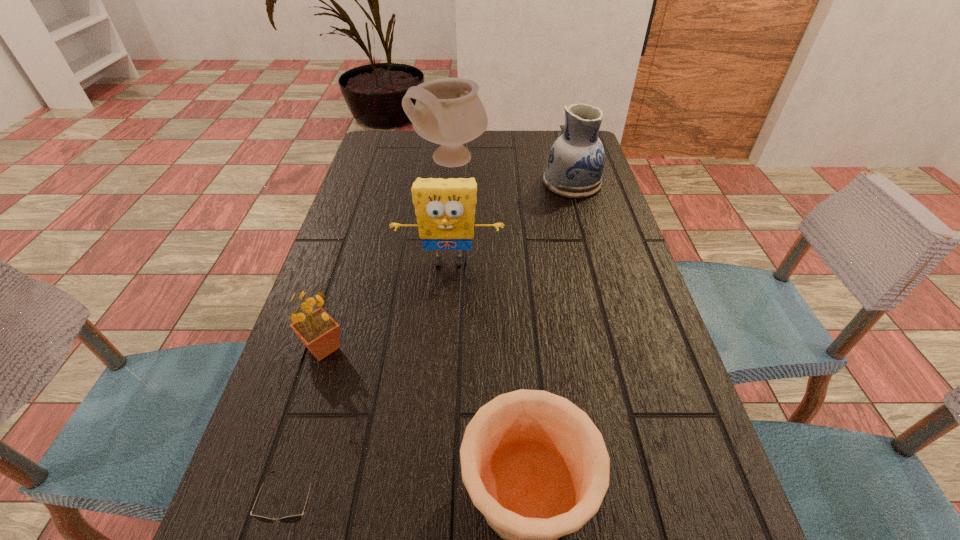
At what (x,y) coordinates should I click in order to perform the action: click on vacant space positioned at the front of the sunflower with flowers visible. Please return your answer as a coordinate pair (x, y). The width and height of the screenshot is (960, 540). Looking at the image, I should click on (466, 348).

Where is `pottery that is positioned at the left edge`? This screenshot has height=540, width=960. pottery that is positioned at the left edge is located at coordinates (448, 111).

Find the location of a particular element. Image resolution: width=960 pixels, height=540 pixels. sponge located at the left edge is located at coordinates 445,208.

What are the coordinates of `sunflower positioned at the left edge` in the screenshot? It's located at (320, 333).

Identify the location of sunglasses that is at the left edge. The width and height of the screenshot is (960, 540). (291, 518).

What are the coordinates of `object that is at the right edge` in the screenshot? It's located at (576, 160).

Locate an element on the screen. object that is at the far left corner is located at coordinates (448, 111).

Find the location of a particular element. object present at the far right corner is located at coordinates (576, 160).

What are the coordinates of `vacant region at the far edge of the desktop` in the screenshot? It's located at (534, 132).

Where is `vacant space at the left edge of the desktop`? The width and height of the screenshot is (960, 540). vacant space at the left edge of the desktop is located at coordinates (363, 199).